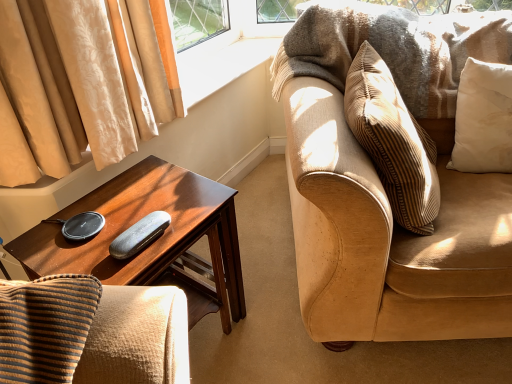
The image size is (512, 384). Identify the location of free space to the left of black textured case at center. (82, 238).